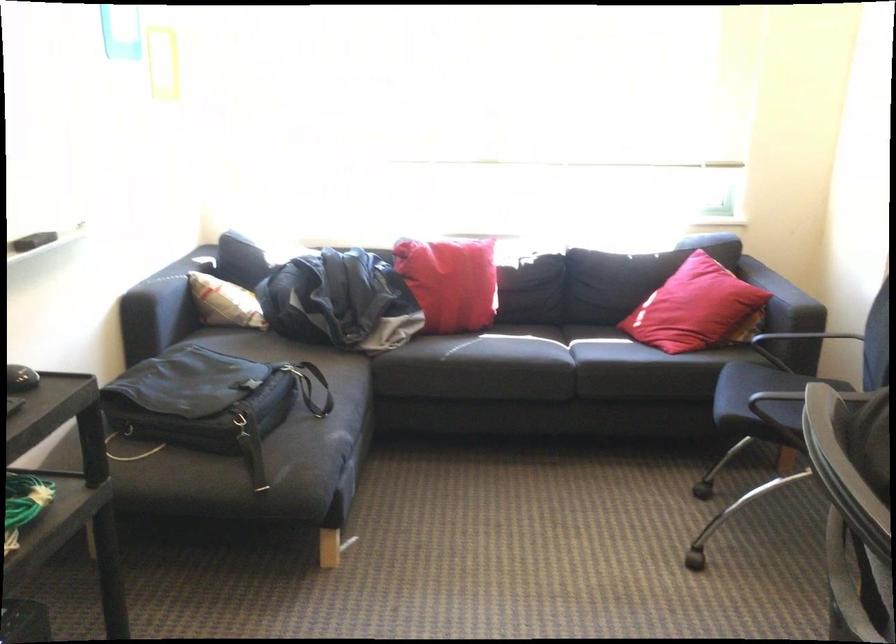
You are a GUI agent. You are given a task and a screenshot of the screen. Output one action in this format:
    pyautogui.click(x=<x>, y=<y>)
    Task: Click on the black bag strap
    This screenshot has height=644, width=896.
    Given the screenshot: What is the action you would take?
    pyautogui.click(x=308, y=384)